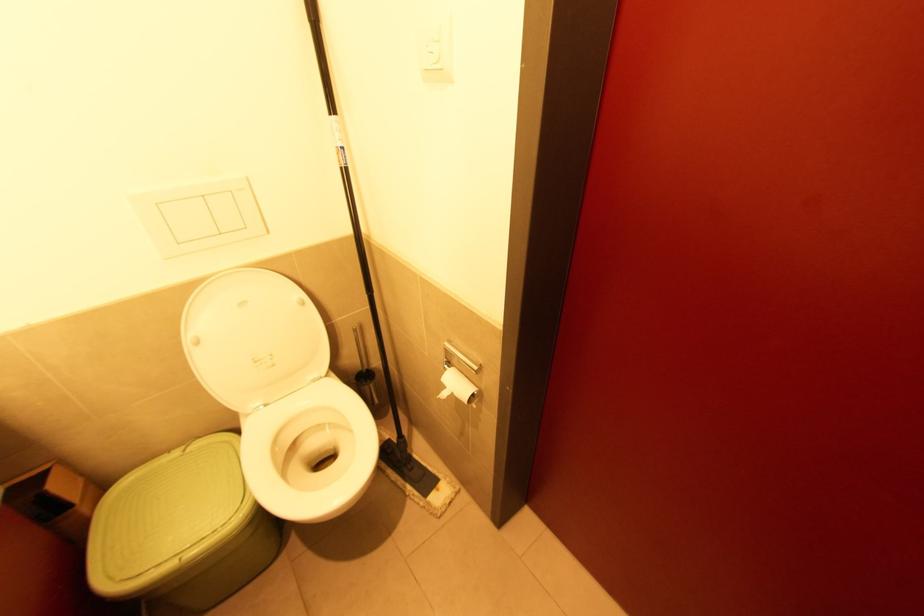
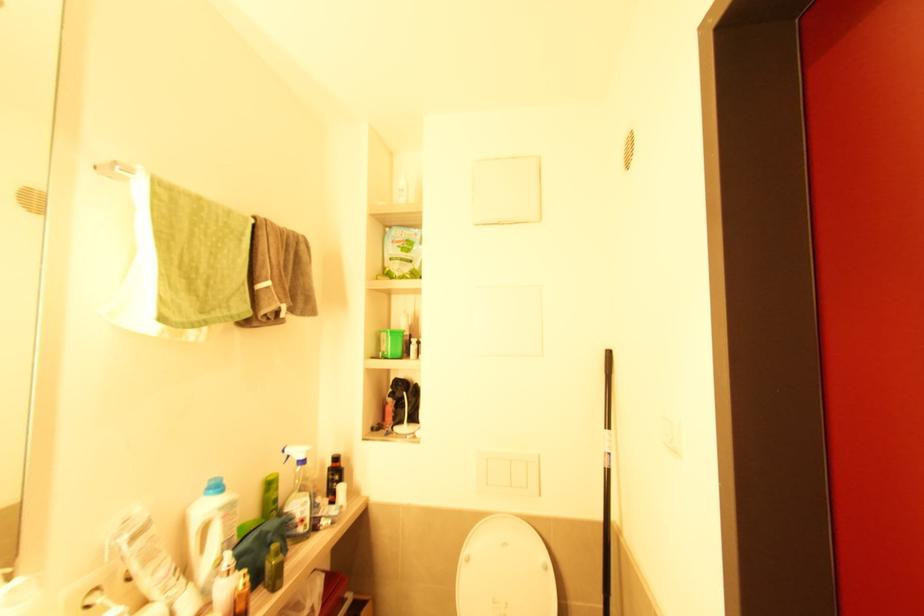
Where in the second image is the point corresponding to [180,245] from the first image?

(489, 485)